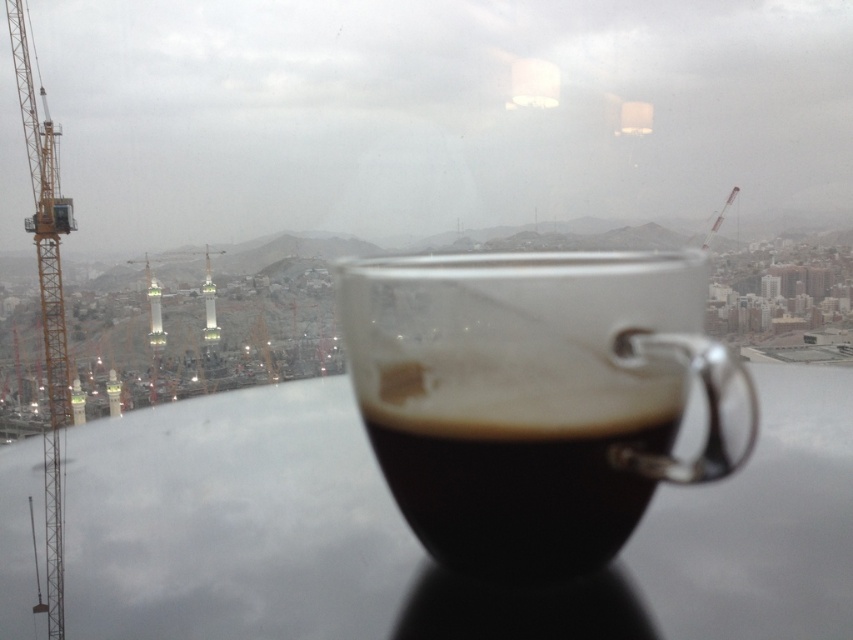
Can you confirm if black matte cup at center is positioned below yellow metallic crane at left?

Yes, black matte cup at center is below yellow metallic crane at left.

Measure the distance between black matte cup at center and camera.

A distance of 7.39 inches exists between black matte cup at center and camera.

At what (x,y) coordinates should I click in order to perform the action: click on black matte cup at center. Please return your answer as a coordinate pair (x, y). Looking at the image, I should click on (515, 458).

At what (x,y) coordinates should I click in order to perform the action: click on black matte cup at center. Please return your answer as a coordinate pair (x, y). Looking at the image, I should click on (515, 458).